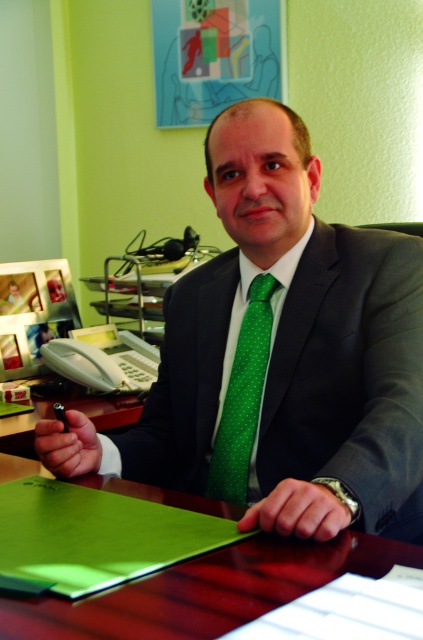
Question: Does matte black suit at center have a greater width compared to wooden table at center?

Choices:
 (A) yes
 (B) no

Answer: (B)

Question: Which point is closer to the camera?

Choices:
 (A) matte black suit at center
 (B) wooden table at center
 (C) green plastic pen at lower left

Answer: (B)

Question: Is the position of wooden table at center less distant than that of green plastic pen at lower left?

Choices:
 (A) yes
 (B) no

Answer: (A)

Question: Estimate the real-world distances between objects in this image. Which object is closer to the matte black suit at center?

Choices:
 (A) green plastic pen at lower left
 (B) green dotted tie at center
 (C) wooden table at center

Answer: (B)

Question: Which point is closer to the camera?

Choices:
 (A) matte black suit at center
 (B) green plastic pen at lower left
 (C) green dotted tie at center
 (D) wooden table at center

Answer: (D)

Question: Can you confirm if matte black suit at center is bigger than green dotted tie at center?

Choices:
 (A) no
 (B) yes

Answer: (B)